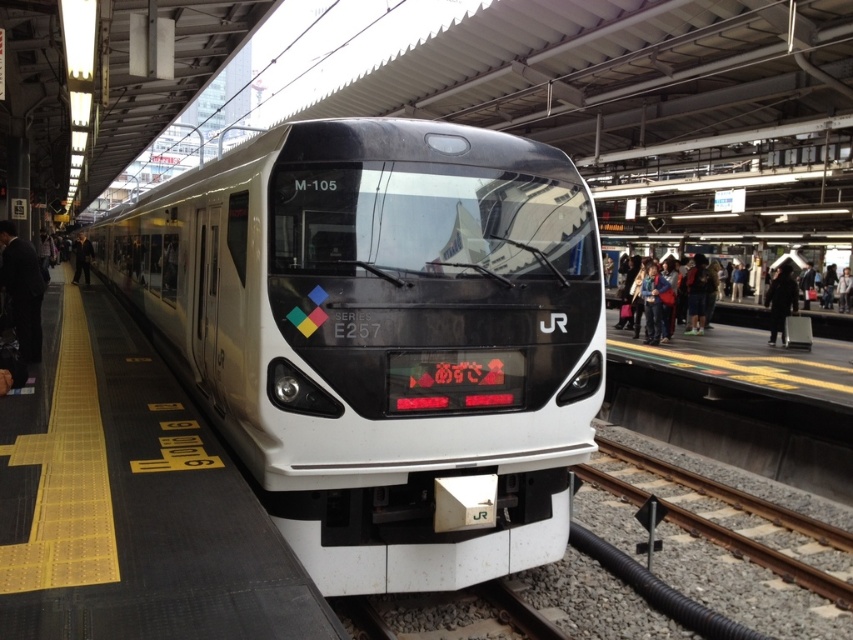
Which of these two, white smooth platform at center or black suit at left, stands shorter?

white smooth platform at center is shorter.

Who is more distant from viewer, (151, 488) or (79, 272)?

Positioned behind is point (79, 272).

Is point (128, 605) closer to camera compared to point (84, 278)?

Yes, point (128, 605) is in front of point (84, 278).

The image size is (853, 640). I want to click on white smooth platform at center, so click(131, 502).

Does black wool coat at center have a lesser height compared to black suit at left?

Yes.

Between black wool coat at center and black suit at left, which one appears on the right side from the viewer's perspective?

black wool coat at center is more to the right.

Identify the location of black wool coat at center. Image resolution: width=853 pixels, height=640 pixels. (780, 300).

What are the coordinates of `black wool coat at center` in the screenshot? It's located at (780, 300).

Does matte black train at center have a larger size compared to black wool coat at center?

Yes.

Is point (199, 170) positioned behind point (785, 308)?

That is False.

Is point (344, 371) more distant than point (790, 291)?

No.

Identify the location of matte black train at center. This screenshot has height=640, width=853. [x=383, y=336].